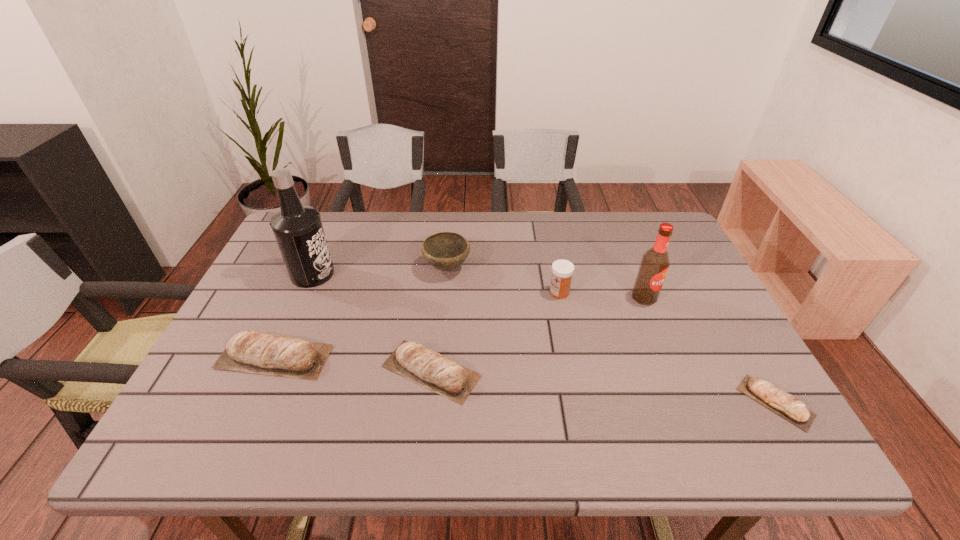
Image resolution: width=960 pixels, height=540 pixels. I want to click on pita bread present at the right edge, so click(x=789, y=407).

The width and height of the screenshot is (960, 540). I want to click on beer bottle located in the right edge section of the desktop, so click(x=654, y=265).

Where is `object that is at the near left corner`? The image size is (960, 540). object that is at the near left corner is located at coordinates (270, 355).

At what (x,y) coordinates should I click in order to perform the action: click on object positioned at the near right corner. Please return your answer as a coordinate pair (x, y). The height and width of the screenshot is (540, 960). Looking at the image, I should click on (789, 407).

Image resolution: width=960 pixels, height=540 pixels. In the image, there is a desktop. What are the coordinates of `vacant space at the far edge` in the screenshot? It's located at (375, 253).

Find the location of a particular element. vacant space at the near edge of the desktop is located at coordinates (667, 404).

I want to click on free space at the left edge of the desktop, so click(x=267, y=272).

Locate an element on the screen. The height and width of the screenshot is (540, 960). vacant space at the right edge is located at coordinates (734, 359).

Where is `vacant region at the near left corner of the desktop`? The width and height of the screenshot is (960, 540). vacant region at the near left corner of the desktop is located at coordinates (202, 411).

In order to click on vacant space at the far right corner of the desktop in this screenshot , I will do `click(677, 245)`.